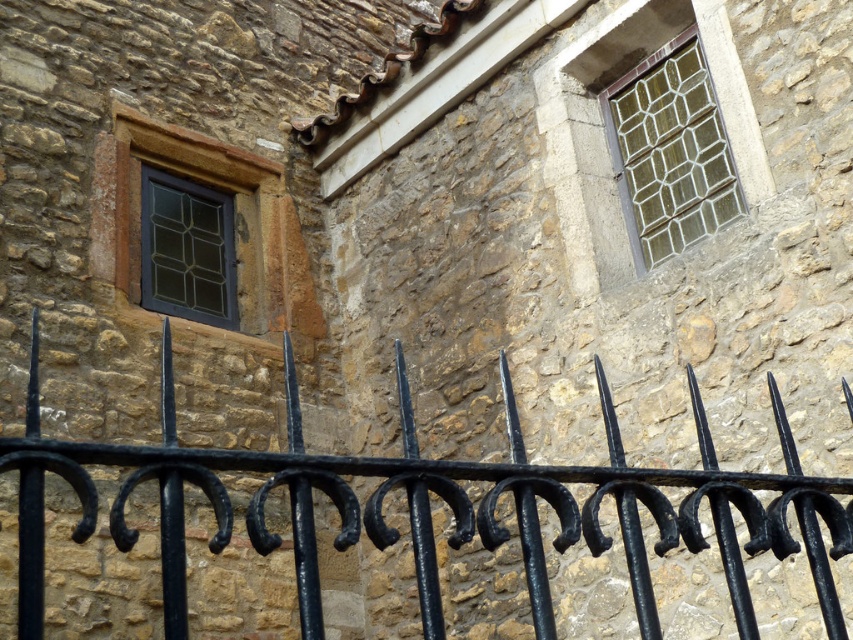
Who is shorter, black wrought iron fence at upper center or stained glass window at upper right?

With less height is black wrought iron fence at upper center.

What do you see at coordinates (428, 506) in the screenshot?
I see `black wrought iron fence at upper center` at bounding box center [428, 506].

Locate an element on the screen. black wrought iron fence at upper center is located at coordinates coord(428,506).

Does point (253, 497) come behind point (187, 296)?

No, (253, 497) is in front of (187, 296).

Who is more forward, (263, 516) or (141, 232)?

Point (263, 516)

Where is `black wrought iron fence at upper center`? black wrought iron fence at upper center is located at coordinates (428, 506).

Does point (643, 200) come in front of point (184, 131)?

That is True.

What are the coordinates of `stained glass window at upper right` in the screenshot? It's located at (670, 150).

Image resolution: width=853 pixels, height=640 pixels. Describe the element at coordinates (670, 150) in the screenshot. I see `stained glass window at upper right` at that location.

I want to click on stained glass window at upper right, so click(x=670, y=150).